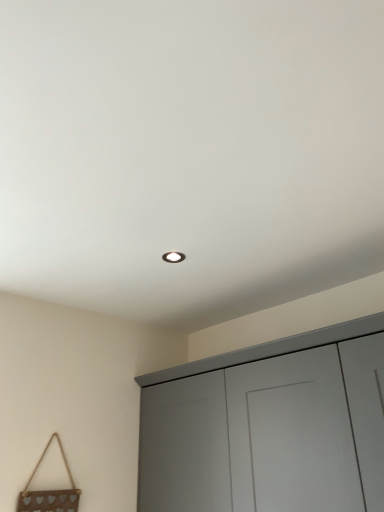
You are a GUI agent. You are given a task and a screenshot of the screen. Output one action in this format:
    pyautogui.click(x=<x>, y=<y>)
    Task: Click on the metallic heart-shaped decoration at lower left
    The height and width of the screenshot is (512, 384).
    Given the screenshot: What is the action you would take?
    pyautogui.click(x=49, y=492)

The width and height of the screenshot is (384, 512). What do you see at coordinates (49, 492) in the screenshot?
I see `metallic heart-shaped decoration at lower left` at bounding box center [49, 492].

Based on the photo, in order to face matte gray cupboard at lower right, should I rotate leftwards or rightwards?

To face it directly, rotate right by 9.902 degrees.

What is the approximate height of matte gray cupboard at lower right?

matte gray cupboard at lower right is 60.43 centimeters tall.

This screenshot has height=512, width=384. Describe the element at coordinates (269, 426) in the screenshot. I see `matte gray cupboard at lower right` at that location.

At what (x,y) coordinates should I click in order to perform the action: click on matte gray cupboard at lower right. Please return your answer as a coordinate pair (x, y). This screenshot has height=512, width=384. Looking at the image, I should click on (269, 426).

In order to click on metallic heart-shaped decoration at lower left in this screenshot , I will do `click(49, 492)`.

Which is more to the right, matte gray cupboard at lower right or metallic heart-shaped decoration at lower left?

Positioned to the right is matte gray cupboard at lower right.

Considering the positions of objects matte gray cupboard at lower right and metallic heart-shaped decoration at lower left in the image provided, who is behind, matte gray cupboard at lower right or metallic heart-shaped decoration at lower left?

metallic heart-shaped decoration at lower left is more distant.

Is point (301, 499) farther from viewer compared to point (50, 494)?

No, (301, 499) is in front of (50, 494).

From the image's perspective, which one is positioned lower, matte gray cupboard at lower right or metallic heart-shaped decoration at lower left?

metallic heart-shaped decoration at lower left is shown below in the image.

From a real-world perspective, who is located lower, matte gray cupboard at lower right or metallic heart-shaped decoration at lower left?

metallic heart-shaped decoration at lower left.

Considering the sizes of objects matte gray cupboard at lower right and metallic heart-shaped decoration at lower left in the image provided, who is thinner, matte gray cupboard at lower right or metallic heart-shaped decoration at lower left?

With smaller width is metallic heart-shaped decoration at lower left.

Does matte gray cupboard at lower right have a greater height compared to metallic heart-shaped decoration at lower left?

Yes.

Considering the relative sizes of matte gray cupboard at lower right and metallic heart-shaped decoration at lower left in the image provided, is matte gray cupboard at lower right bigger than metallic heart-shaped decoration at lower left?

Yes, matte gray cupboard at lower right is bigger than metallic heart-shaped decoration at lower left.

Would you say matte gray cupboard at lower right is inside or outside metallic heart-shaped decoration at lower left?

matte gray cupboard at lower right is outside metallic heart-shaped decoration at lower left.

Is the surface of matte gray cupboard at lower right in direct contact with metallic heart-shaped decoration at lower left?

No.

Is matte gray cupboard at lower right turned away from metallic heart-shaped decoration at lower left?

That's not correct — matte gray cupboard at lower right is not looking away from metallic heart-shaped decoration at lower left.

Can you tell me how much matte gray cupboard at lower right and metallic heart-shaped decoration at lower left differ in facing direction?

90.7 degrees separate the facing orientations of matte gray cupboard at lower right and metallic heart-shaped decoration at lower left.

The image size is (384, 512). In order to click on handbag behind the matte gray cupboard at lower right in this screenshot , I will do `click(49, 492)`.

Between metallic heart-shaped decoration at lower left and matte gray cupboard at lower right, which one appears on the left side from the viewer's perspective?

Positioned to the left is metallic heart-shaped decoration at lower left.

Is metallic heart-shaped decoration at lower left positioned in front of matte gray cupboard at lower right?

That is False.

Between point (63, 456) and point (377, 439), which one is positioned in front?

The point (377, 439) is closer.

From the image's perspective, is metallic heart-shaped decoration at lower left located above or below matte gray cupboard at lower right?

Clearly, from the image's perspective, metallic heart-shaped decoration at lower left is below matte gray cupboard at lower right.

From the picture: From a real-world perspective, is metallic heart-shaped decoration at lower left physically located above or below matte gray cupboard at lower right?

From a real-world perspective, metallic heart-shaped decoration at lower left is physically below matte gray cupboard at lower right.

Can you confirm if metallic heart-shaped decoration at lower left is thinner than matte gray cupboard at lower right?

Indeed, metallic heart-shaped decoration at lower left has a lesser width compared to matte gray cupboard at lower right.

Considering the sizes of metallic heart-shaped decoration at lower left and matte gray cupboard at lower right in the image, is metallic heart-shaped decoration at lower left taller or shorter than matte gray cupboard at lower right?

Clearly, metallic heart-shaped decoration at lower left is shorter compared to matte gray cupboard at lower right.

Looking at the image, does metallic heart-shaped decoration at lower left seem bigger or smaller compared to matte gray cupboard at lower right?

metallic heart-shaped decoration at lower left is smaller than matte gray cupboard at lower right.

Is metallic heart-shaped decoration at lower left inside or outside of matte gray cupboard at lower right?

metallic heart-shaped decoration at lower left is spatially situated outside matte gray cupboard at lower right.

Are metallic heart-shaped decoration at lower left and matte gray cupboard at lower right far apart?

No.

Is metallic heart-shaped decoration at lower left facing away from matte gray cupboard at lower right?

No, metallic heart-shaped decoration at lower left's orientation is not away from matte gray cupboard at lower right.

How many degrees apart are the facing directions of metallic heart-shaped decoration at lower left and matte gray cupboard at lower right?

The facing directions of metallic heart-shaped decoration at lower left and matte gray cupboard at lower right are 90.7 degrees apart.

How much distance is there between metallic heart-shaped decoration at lower left and matte gray cupboard at lower right?

metallic heart-shaped decoration at lower left is 71.87 centimeters from matte gray cupboard at lower right.

This screenshot has width=384, height=512. Find the location of `handbag on the left of the matte gray cupboard at lower right`. handbag on the left of the matte gray cupboard at lower right is located at coordinates (49, 492).

At what (x,y) coordinates should I click in order to perform the action: click on cupboard on the right of metallic heart-shaped decoration at lower left. Please return your answer as a coordinate pair (x, y). The width and height of the screenshot is (384, 512). Looking at the image, I should click on (269, 426).

The image size is (384, 512). Identify the location of handbag located underneath the matte gray cupboard at lower right (from a real-world perspective). (49, 492).